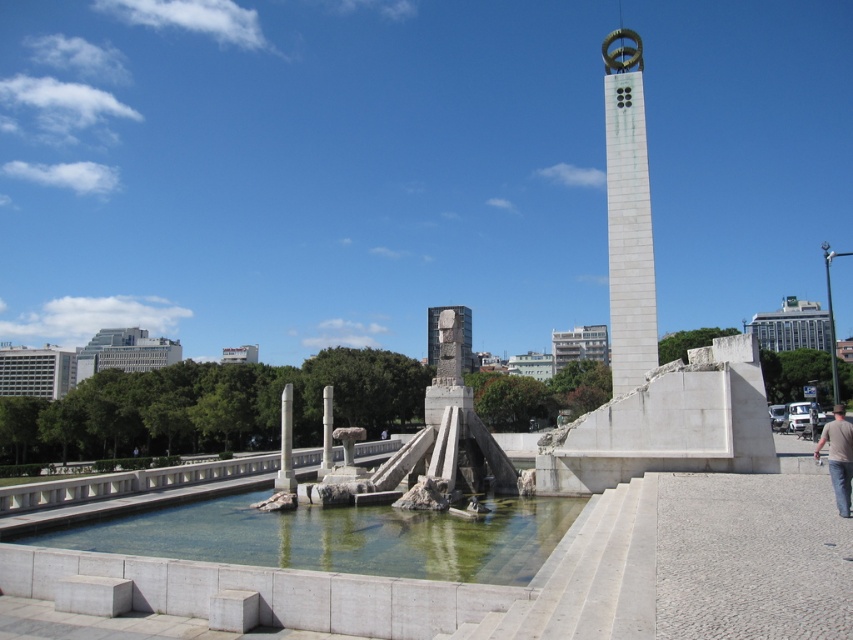
You are a photographer wanting to capture the sculpture and the water feature in one shot. The camera you are using has a limited field of view. Based on the scene, which object, the clear glass water at center or the brown cotton shirt at lower right, is positioned closer to the camera to ensure both the sculpture and water feature are in focus?

The clear glass water at center is wider than the brown cotton shirt at lower right, so it is positioned closer to the camera. This placement allows the photographer to include both the sculpture and water feature within the frame while maintaining focus.

You are standing at the entrance of the park and see the point marked at coordinates (340, 538). What is located at that point?

The point at coordinates (340, 538) has clear glass water at center.